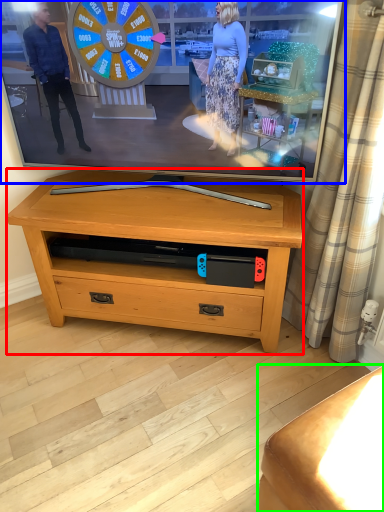
Question: Considering the real-world distances, which object is closest to table (highlighted by a red box)? television (highlighted by a blue box) or furniture (highlighted by a green box).

Choices:
 (A) television
 (B) furniture

Answer: (A)